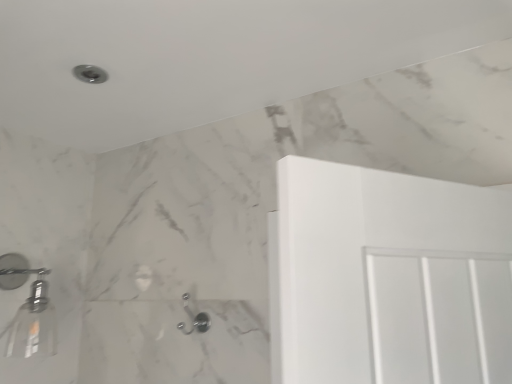
Question: In terms of width, does matte silver shower at upper left, the 2th shower when ordered from right to left, look wider or thinner when compared to satin nickel hook at lower center, the 3th shower in the top-to-bottom sequence?

Choices:
 (A) thin
 (B) wide

Answer: (B)

Question: Relative to satin nickel hook at lower center, which ranks as the first shower in bottom-to-top order, is matte silver shower at upper left, the 2th shower when ordered from right to left, in front or behind?

Choices:
 (A) behind
 (B) front

Answer: (B)

Question: Which object is the farthest from the satin nickel hook at lower center, which ranks as the first shower in right-to-left order?

Choices:
 (A) metallic silver showerhead at left, positioned as the 1th shower in left-to-right order
 (B) matte silver shower at upper left, the 3th shower ordered from the bottom

Answer: (B)

Question: Which object is positioned closest to the metallic silver showerhead at left, arranged as the second shower when viewed from the top?

Choices:
 (A) satin nickel hook at lower center, which ranks as the first shower in bottom-to-top order
 (B) matte silver shower at upper left, the 2th shower when ordered from right to left

Answer: (A)